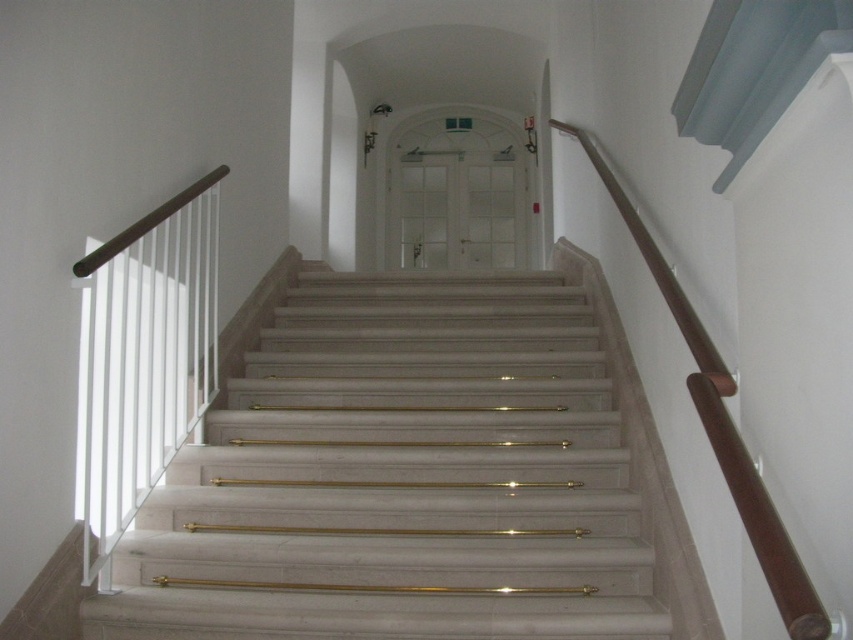
Does white marble stairs at center appear under brown polished wood handrail at upper right?

Yes.

Between white marble stairs at center and brown polished wood handrail at upper right, which one has less height?

brown polished wood handrail at upper right is shorter.

Locate an element on the screen. white marble stairs at center is located at coordinates (399, 477).